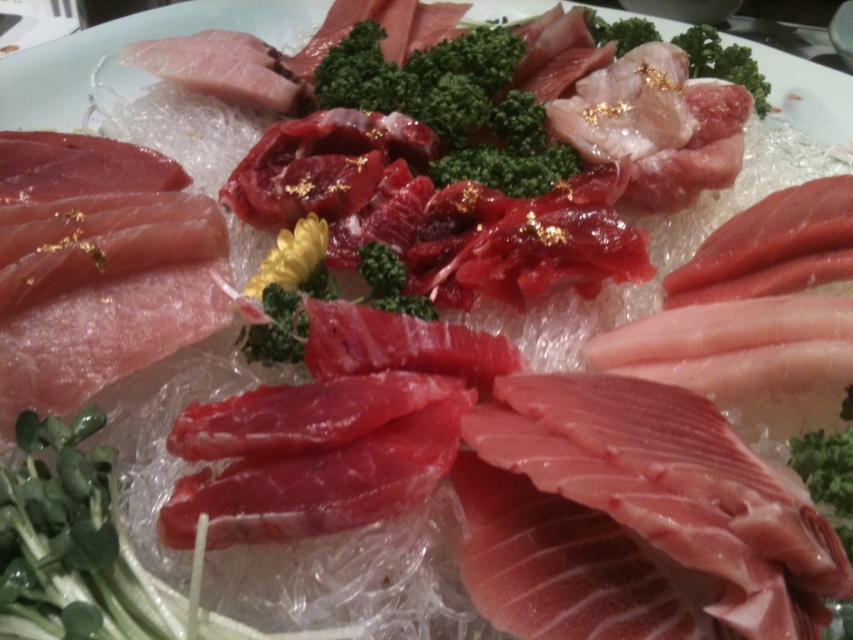
Between point (90, 467) and point (694, 56), which one is positioned in front?

Point (90, 467)

Is point (144, 634) positioned behind point (695, 72)?

No, (144, 634) is in front of (695, 72).

You are a GUI agent. You are given a task and a screenshot of the screen. Output one action in this format:
    pyautogui.click(x=<x>, y=<y>)
    Task: Click on the green leafy vegetable at center
    
    Given the screenshot: What is the action you would take?
    pyautogui.click(x=90, y=552)